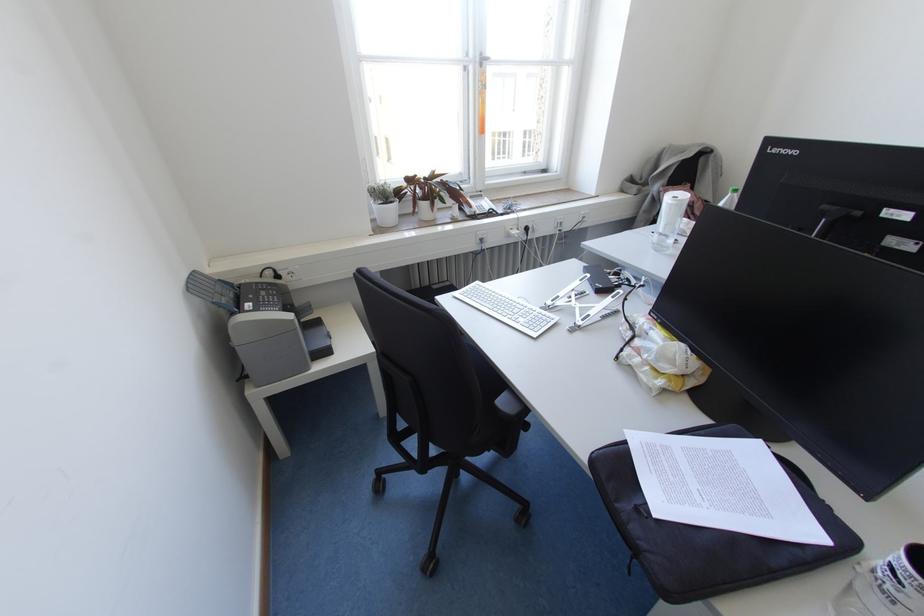
The width and height of the screenshot is (924, 616). Identify the location of clear water glass. (883, 586).